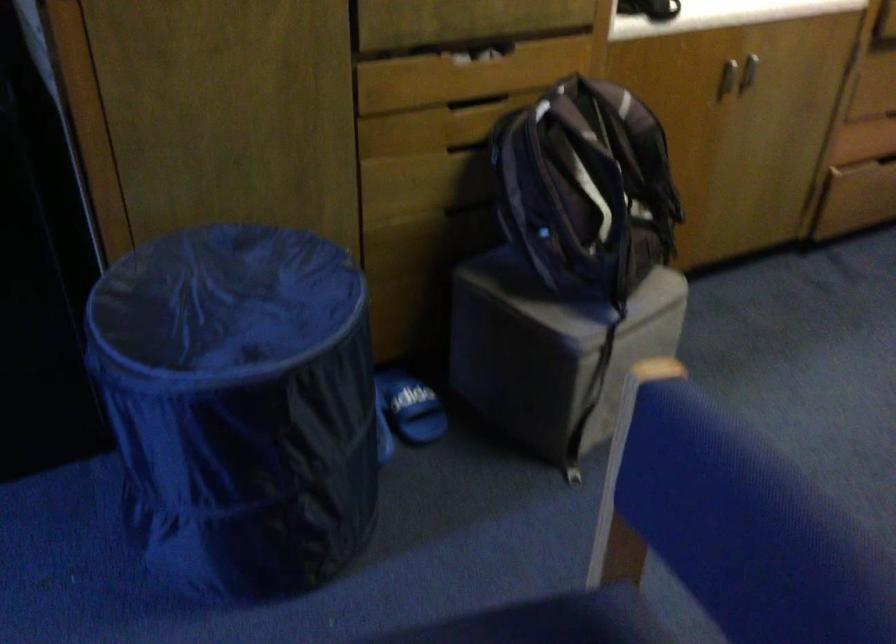
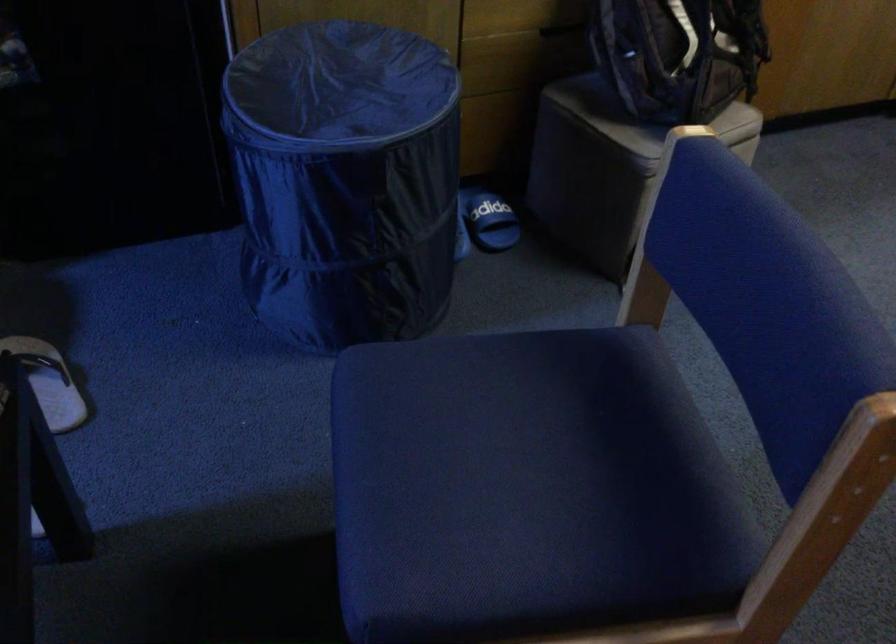
Question: The images are taken continuously from a first-person perspective. In which direction are you moving?

Choices:
 (A) Left
 (B) Right
 (C) Forward
 (D) Backward

Answer: (D)